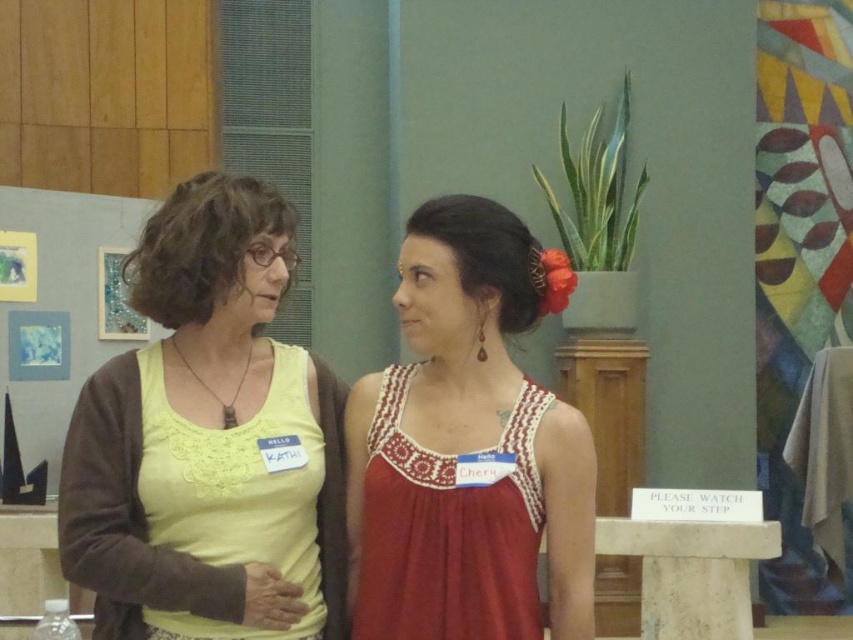
Is matte yellow tank top at center below red satin dress at center?

No.

Find the location of a particular element. Image resolution: width=853 pixels, height=640 pixels. matte yellow tank top at center is located at coordinates (209, 442).

Between point (201, 173) and point (514, 216), which one is positioned in front?

Point (514, 216) is in front.

This screenshot has width=853, height=640. I want to click on matte yellow tank top at center, so click(209, 442).